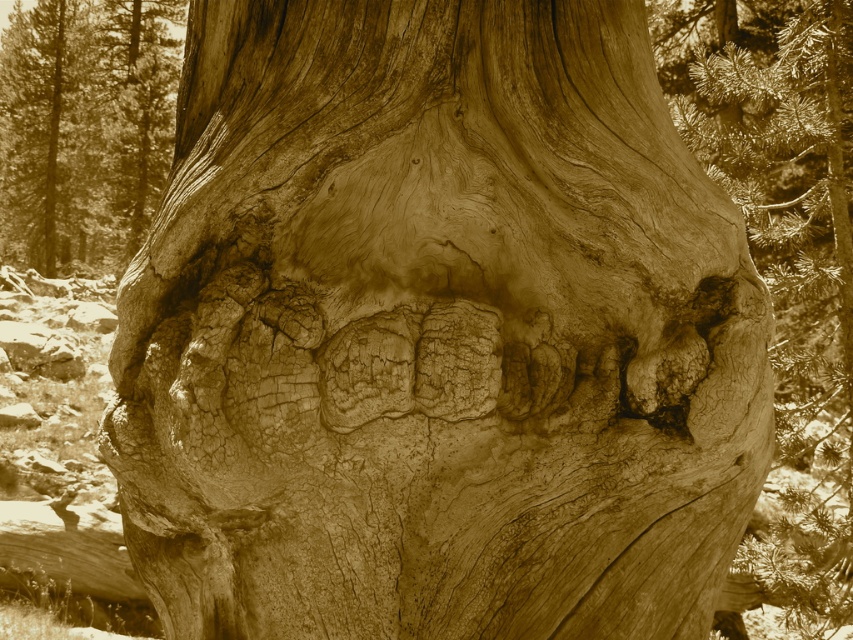
Does rough bark tree trunk at center appear on the right side of rough textured bark at center?

Yes, rough bark tree trunk at center is to the right of rough textured bark at center.

Does point (769, 3) come in front of point (27, 193)?

Yes, point (769, 3) is in front of point (27, 193).

Find the location of a particular element. This screenshot has height=640, width=853. rough bark tree trunk at center is located at coordinates (785, 250).